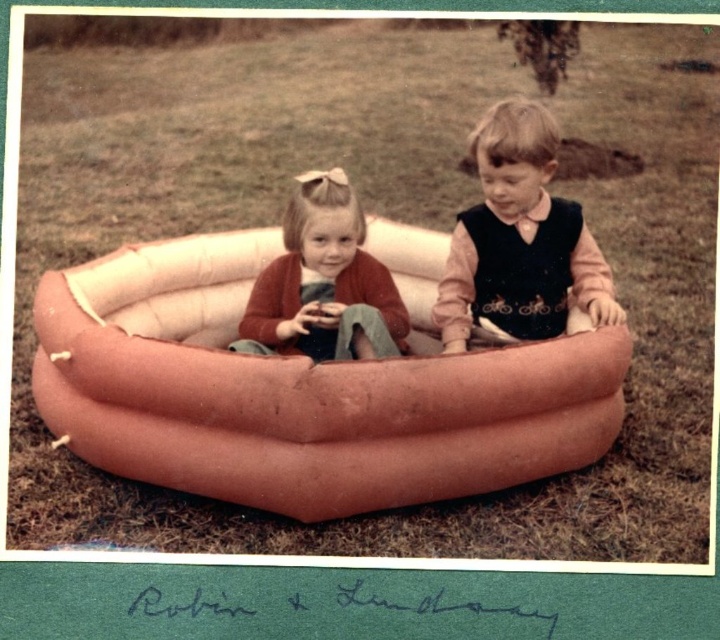
Question: Is velvet-like brown vest at center to the left of matte orange inflatable pool at center from the viewer's perspective?

Choices:
 (A) no
 (B) yes

Answer: (A)

Question: Does pink rubber boat at center appear on the left side of matte orange inflatable pool at center?

Choices:
 (A) yes
 (B) no

Answer: (B)

Question: Which of these objects is positioned farthest from the pink rubber boat at center?

Choices:
 (A) velvet-like brown vest at center
 (B) matte orange inflatable pool at center

Answer: (A)

Question: Which point is farther to the camera?

Choices:
 (A) pink rubber boat at center
 (B) velvet-like brown vest at center
 (C) matte orange inflatable pool at center

Answer: (B)

Question: Which object is positioned farthest from the matte orange inflatable pool at center?

Choices:
 (A) pink rubber boat at center
 (B) velvet-like brown vest at center

Answer: (A)

Question: Is the position of pink rubber boat at center less distant than that of matte orange inflatable pool at center?

Choices:
 (A) yes
 (B) no

Answer: (A)